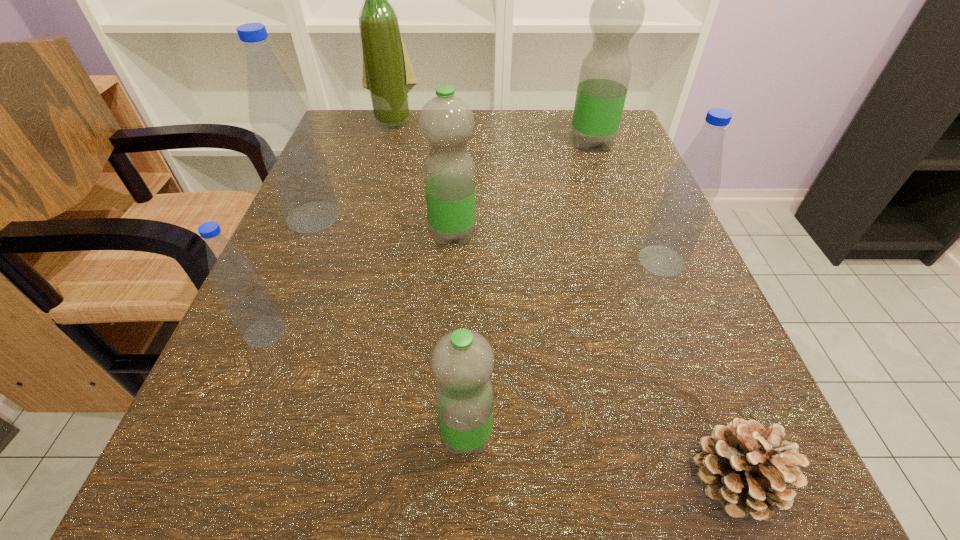
This screenshot has height=540, width=960. In order to click on vacant space that's between the farthest blue water bottle and the nearest blue water bottle in this screenshot , I will do `click(290, 275)`.

You are a GUI agent. You are given a task and a screenshot of the screen. Output one action in this format:
    pyautogui.click(x=<x>, y=<y>)
    Task: Click on the blank region between the pinecone and the smallest blue water bottle
    
    Given the screenshot: What is the action you would take?
    pyautogui.click(x=499, y=406)

This screenshot has height=540, width=960. Find the location of `free space between the rightmost green water bottle and the sixth farthest object`. free space between the rightmost green water bottle and the sixth farthest object is located at coordinates [429, 238].

Identify the location of free space between the pinecone and the biggest green water bottle. (662, 312).

Where is `unoccupied area between the nearest water bottle and the wine bottle`? This screenshot has height=540, width=960. unoccupied area between the nearest water bottle and the wine bottle is located at coordinates (430, 278).

At what (x,y) coordinates should I click in order to perform the action: click on free space between the wine bottle and the biggest blue water bottle. Please return your answer as a coordinate pair (x, y). The height and width of the screenshot is (540, 960). Looking at the image, I should click on (353, 169).

You are a GUI agent. You are given a task and a screenshot of the screen. Output one action in this format:
    pyautogui.click(x=<x>, y=<y>)
    Task: Click on the object identified as the closest to the second smallest green water bottle
    
    Given the screenshot: What is the action you would take?
    pyautogui.click(x=279, y=118)

At what (x,y) coordinates should I click in order to perform the action: click on object identified as the fifth closest to the wine bottle. Please return your answer as a coordinate pair (x, y). Looking at the image, I should click on (693, 183).

In order to click on water bottle that is the fifth closest to the biggest green water bottle in this screenshot , I will do `click(249, 303)`.

Locate an element on the screen. The height and width of the screenshot is (540, 960). water bottle that is the fifth closest one to the nearest water bottle is located at coordinates (617, 13).